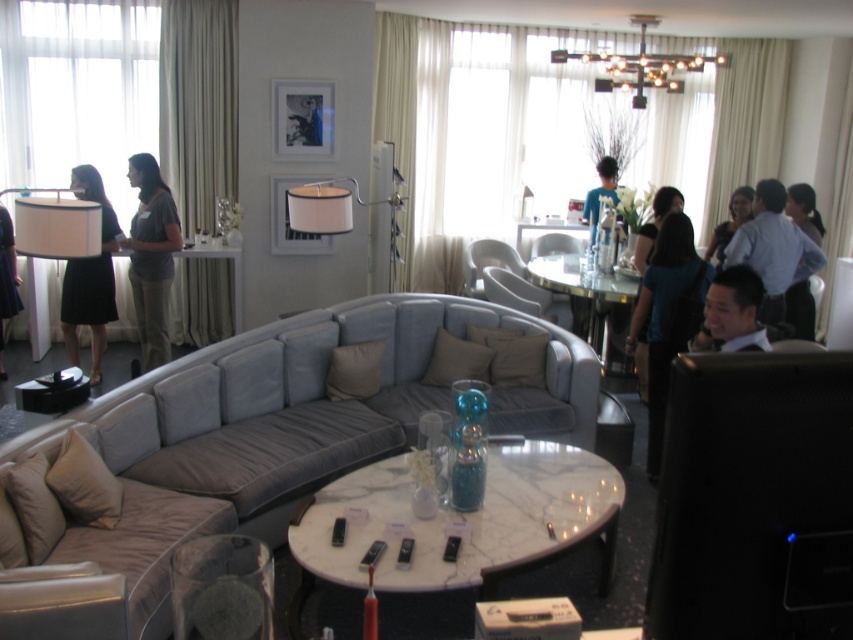
This screenshot has height=640, width=853. What do you see at coordinates (587, 296) in the screenshot? I see `metallic glass table at center` at bounding box center [587, 296].

Consider the image. Between metallic glass table at center and matte black shirt at upper right, which one is positioned higher?

matte black shirt at upper right is above.

Which is behind, point (564, 282) or point (747, 196)?

Point (564, 282)

Locate an element on the screen. This screenshot has width=853, height=640. metallic glass table at center is located at coordinates (587, 296).

Can you confirm if white marble coffee table at center is thinner than white marble table at center?

No, white marble coffee table at center is not thinner than white marble table at center.

Does white marble coffee table at center appear on the left side of white marble table at center?

Yes, white marble coffee table at center is to the left of white marble table at center.

Between point (593, 465) and point (570, 228), which one is positioned in front?

Point (593, 465)

Find the location of `white marble coffee table at center`. white marble coffee table at center is located at coordinates (462, 522).

Consider the image. Can you confirm if black fabric shirt at right is bigger than white marble table at center?

Yes, black fabric shirt at right is bigger than white marble table at center.

You are a GUI agent. You are given a task and a screenshot of the screen. Output one action in this format:
    pyautogui.click(x=<x>, y=<y>)
    Task: Click on the black fabric shirt at right
    
    Given the screenshot: What is the action you would take?
    pyautogui.click(x=804, y=211)

Find the location of a particular element. black fabric shirt at right is located at coordinates (804, 211).